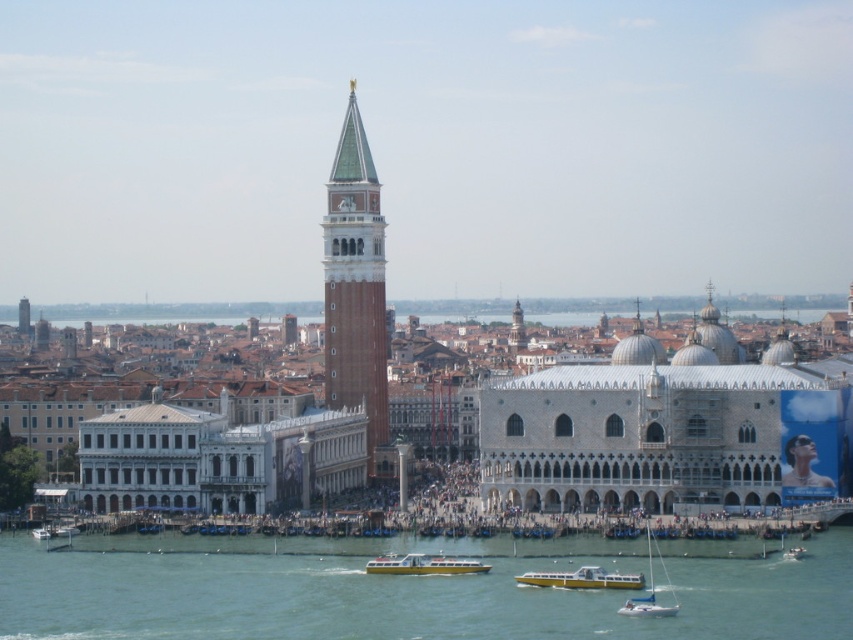
Question: Is clear blue water at lower center wider than yellow plastic boat at center?

Choices:
 (A) yes
 (B) no

Answer: (A)

Question: Is green-tiled bell tower at center above white plastic sailboat at lower right?

Choices:
 (A) yes
 (B) no

Answer: (A)

Question: Is clear blue water at lower center further to the viewer compared to white plastic boat at lower right?

Choices:
 (A) no
 (B) yes

Answer: (A)

Question: Which point is closer to the camera taking this photo?

Choices:
 (A) (647, 602)
 (B) (575, 570)
 (C) (442, 573)
 (D) (782, 552)

Answer: (A)

Question: Which point is farther to the camera?

Choices:
 (A) white plastic boat at center
 (B) green-tiled bell tower at center
 (C) white plastic sailboat at lower right

Answer: (B)

Question: Which point appears farthest from the camera in this image?

Choices:
 (A) (732, 628)
 (B) (787, 548)
 (C) (460, 570)

Answer: (B)